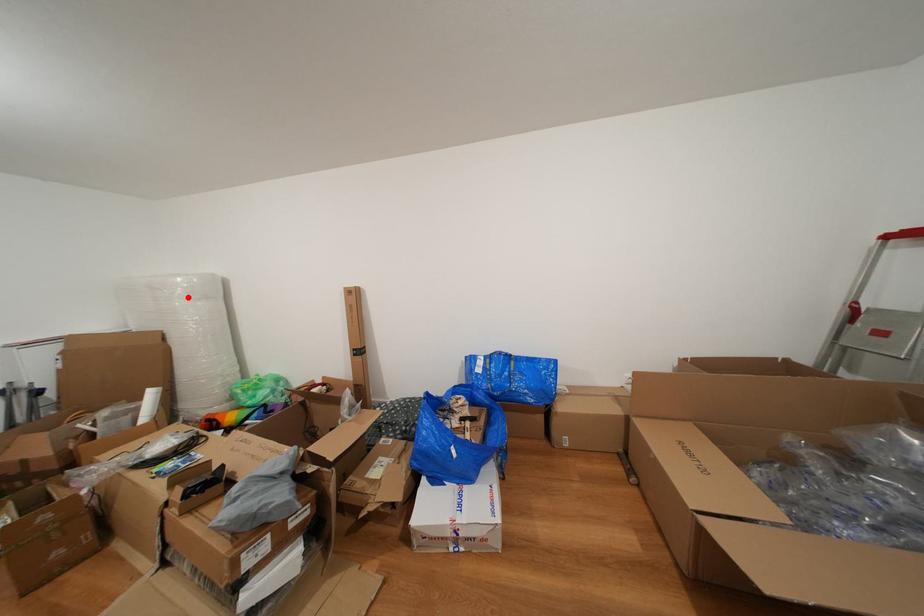
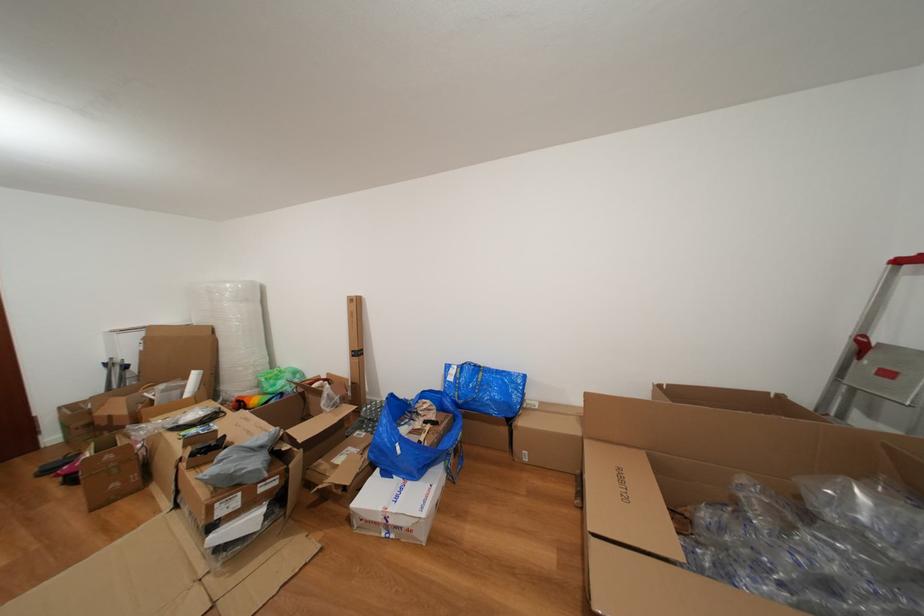
In the second image, find the point that corresponds to the highlighted location in the first image.

(237, 301)